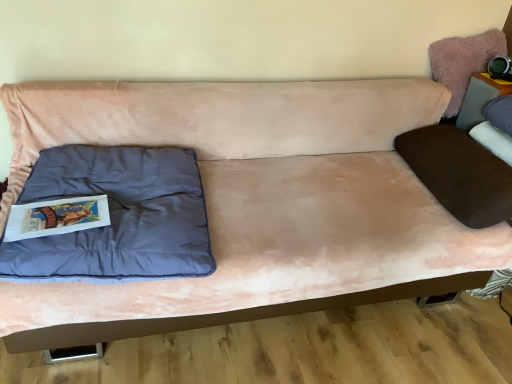
Question: Is point (1, 241) closer or farther from the camera than point (453, 66)?

Choices:
 (A) farther
 (B) closer

Answer: (B)

Question: Considering the relative positions of matte blue pillow at left and fuzzy pink pillow at upper right in the image provided, is matte blue pillow at left to the left or to the right of fuzzy pink pillow at upper right?

Choices:
 (A) left
 (B) right

Answer: (A)

Question: Which of these objects is positioned farthest from the matte blue pillow at left?

Choices:
 (A) pink suede couch at center
 (B) fuzzy pink pillow at upper right
 (C) matte gray table at upper right

Answer: (C)

Question: Estimate the real-world distances between objects in this image. Which object is farther from the matte gray table at upper right?

Choices:
 (A) pink suede couch at center
 (B) fuzzy pink pillow at upper right
 (C) matte blue pillow at left

Answer: (C)